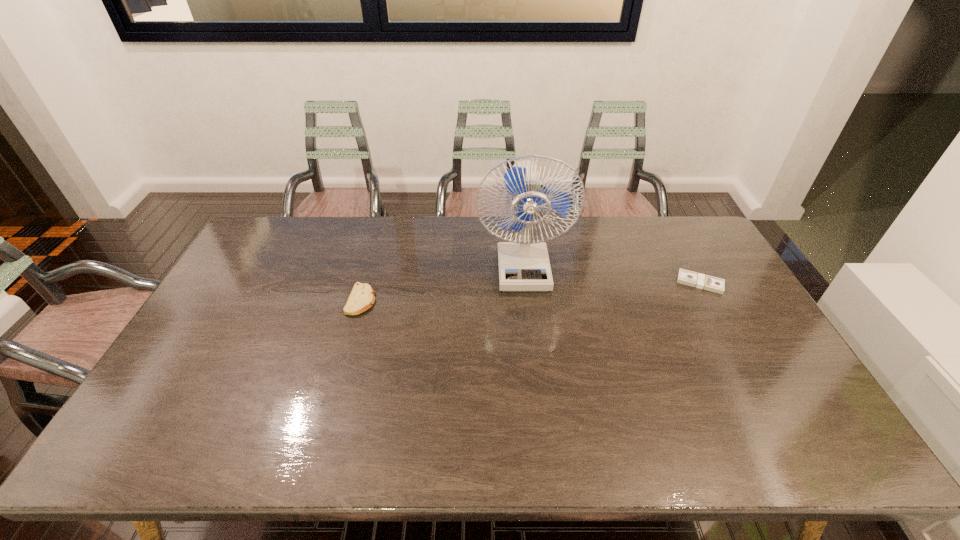
This screenshot has width=960, height=540. I want to click on the tallest object, so click(523, 265).

At what (x,y) coordinates should I click in order to perform the action: click on fan. Please return your answer as a coordinate pair (x, y). The width and height of the screenshot is (960, 540). Looking at the image, I should click on (523, 265).

Find the location of a particular element. This screenshot has width=960, height=540. the leftmost object is located at coordinates (361, 298).

Identify the location of pita bread. Image resolution: width=960 pixels, height=540 pixels. (361, 298).

This screenshot has height=540, width=960. In order to click on the shortest object in this screenshot , I will do `click(686, 277)`.

The image size is (960, 540). I want to click on the rightmost object, so click(686, 277).

This screenshot has width=960, height=540. Find the location of `free spot located on the front-facing side of the tallest object`. free spot located on the front-facing side of the tallest object is located at coordinates (532, 351).

The width and height of the screenshot is (960, 540). I want to click on blank space located on the front of the leftmost object, so click(326, 428).

Locate an element on the screen. free space located on the front of the dollar is located at coordinates (742, 361).

The height and width of the screenshot is (540, 960). Find the location of `object that is at the far edge`. object that is at the far edge is located at coordinates (523, 265).